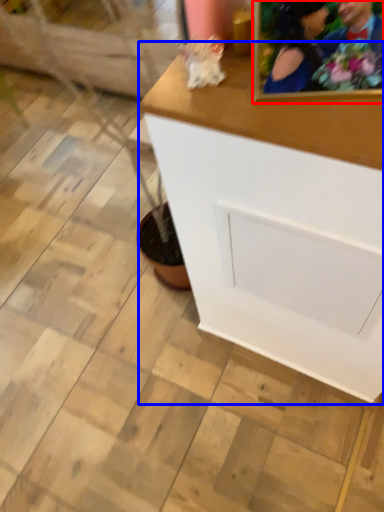
Question: Which object appears farthest to the camera in this image, picture frame (highlighted by a red box) or table (highlighted by a blue box)?

Choices:
 (A) picture frame
 (B) table

Answer: (B)